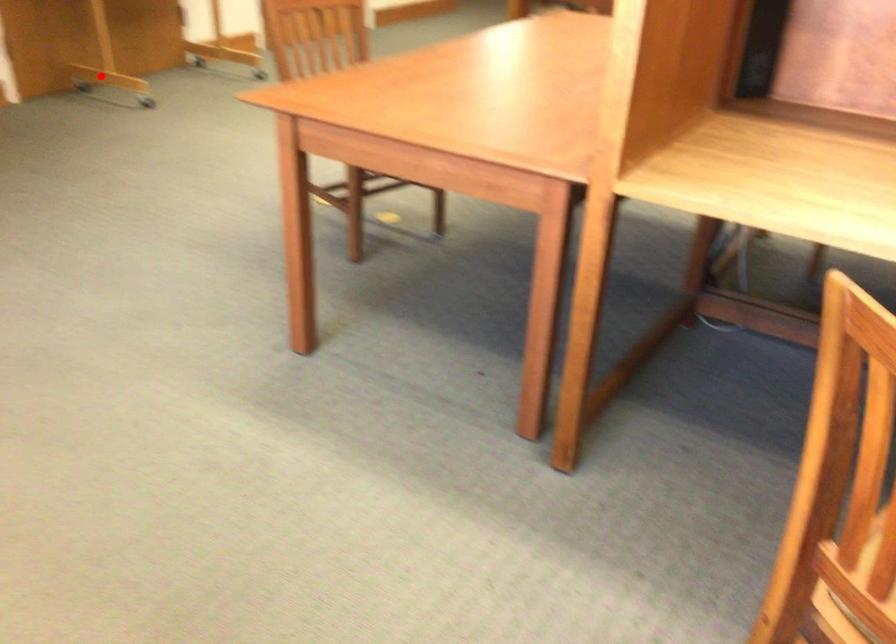
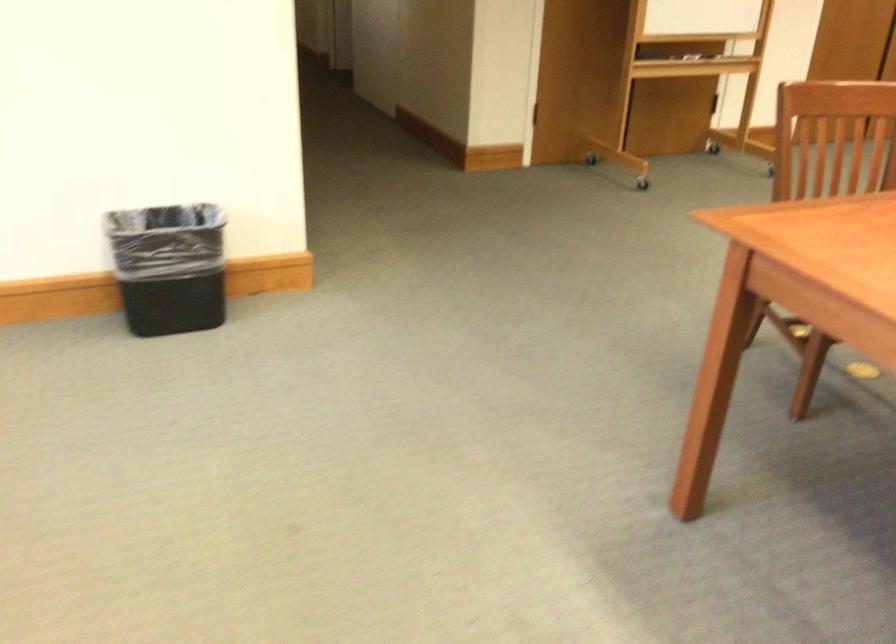
In the second image, find the point that corresponds to the highlighted location in the first image.

(595, 153)